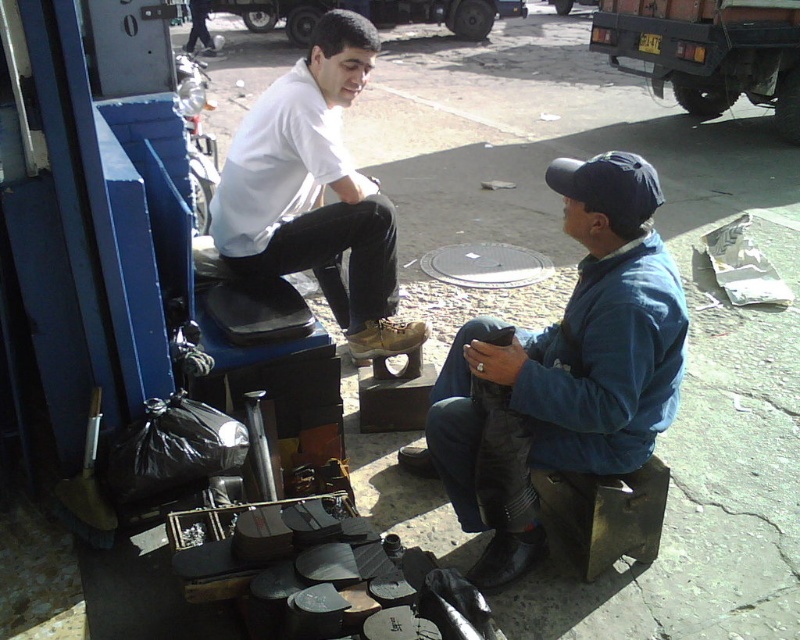
Measure the distance from blue denim jacket at lower right to white matte shoe at center.

blue denim jacket at lower right and white matte shoe at center are 28.51 inches apart.

Is blue denim jacket at lower right to the right of white matte shoe at center from the viewer's perspective?

Yes, blue denim jacket at lower right is to the right of white matte shoe at center.

Between point (658, 384) and point (298, 243), which one is positioned in front?

Point (658, 384)

Image resolution: width=800 pixels, height=640 pixels. What are the coordinates of `blue denim jacket at lower right` in the screenshot? It's located at [x=568, y=358].

What do you see at coordinates (568, 358) in the screenshot? I see `blue denim jacket at lower right` at bounding box center [568, 358].

Is point (476, 456) positioned after point (400, 449)?

No, it is not.

Locate an element on the screen. Image resolution: width=800 pixels, height=640 pixels. blue denim jacket at lower right is located at coordinates (568, 358).

The width and height of the screenshot is (800, 640). Identify the location of brown leather shoe at center. (386, 339).

Between brown leather shoe at center and shiny black shoe at center, which one has more height?

Standing taller between the two is brown leather shoe at center.

Is point (370, 355) positioned behind point (410, 458)?

Yes, point (370, 355) is behind point (410, 458).

Image resolution: width=800 pixels, height=640 pixels. I want to click on brown leather shoe at center, so click(386, 339).